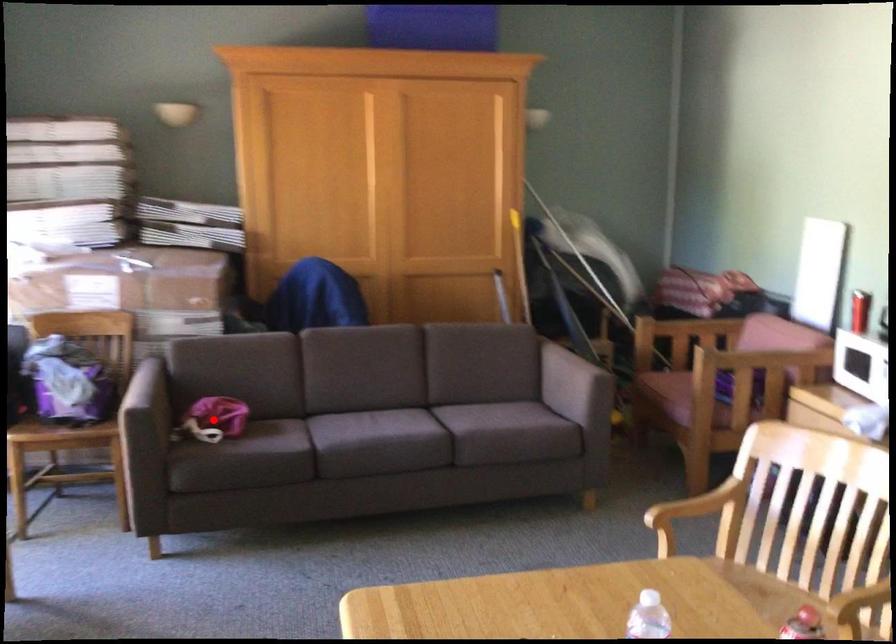
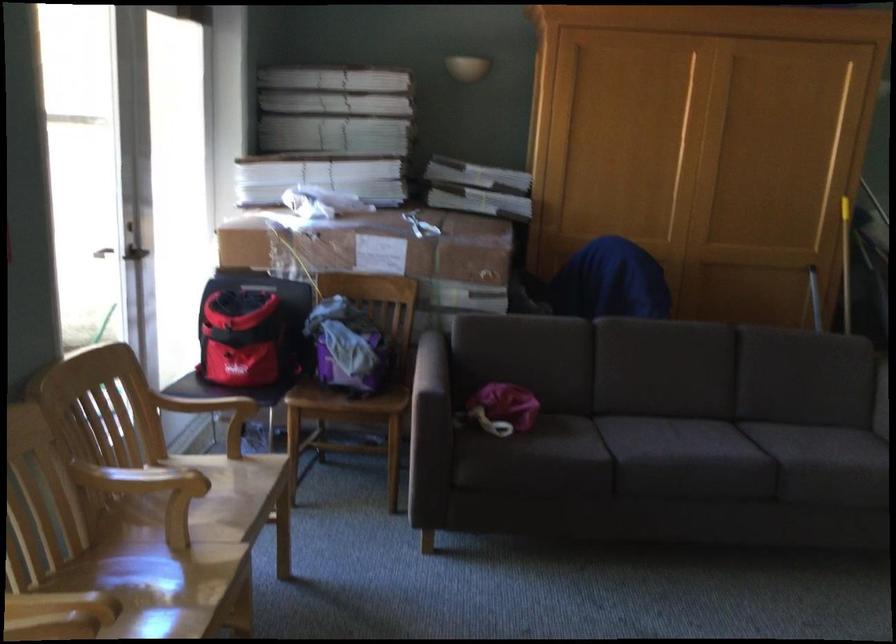
Question: I am providing you with two images of the same scene from different viewpoints. In image1, a red point is highlighted. Considering the same 3D point in image2, which of the following is correct?

Choices:
 (A) It is closer
 (B) It is farther

Answer: (A)